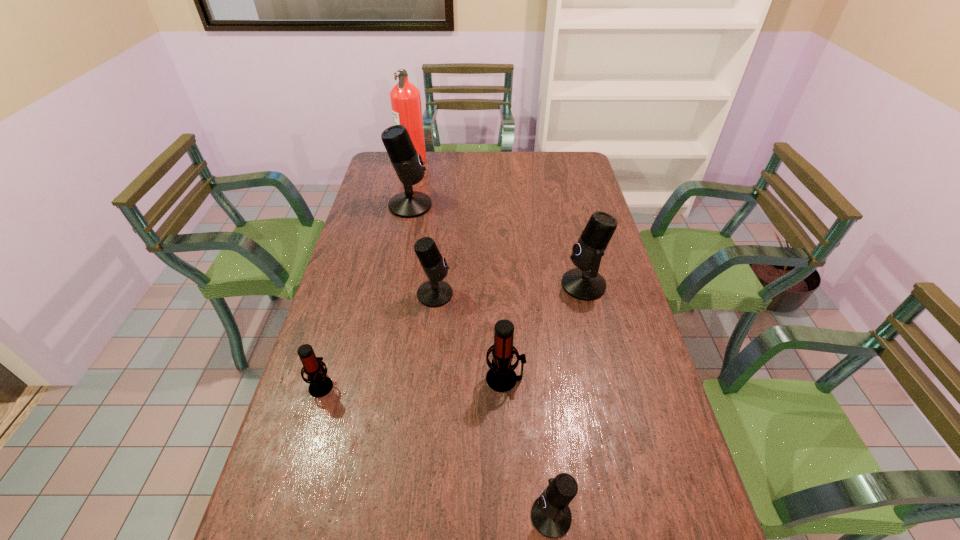
Identify the location of blank space located 0.200m on the stand of the smallest black microphone. Image resolution: width=960 pixels, height=540 pixels. (436, 516).

Image resolution: width=960 pixels, height=540 pixels. What are the coordinates of `vacant region located on the stand of the smallest black microphone` in the screenshot? It's located at (412, 516).

Find the location of `blank area located on the stand of the smallest black microphone`. blank area located on the stand of the smallest black microphone is located at coordinates (445, 516).

Locate an element on the screen. This screenshot has height=540, width=960. object at the far edge is located at coordinates (405, 98).

Image resolution: width=960 pixels, height=540 pixels. Identify the location of fire extinguisher that is at the left edge. (405, 98).

Identify the location of object located in the right edge section of the desktop. (584, 283).

Where is `object at the far left corner`? object at the far left corner is located at coordinates (405, 98).

Locate an element on the screen. The image size is (960, 540). vacant space at the far edge of the desktop is located at coordinates (460, 178).

The height and width of the screenshot is (540, 960). I want to click on vacant region at the left edge of the desktop, so click(x=394, y=238).

Locate an element on the screen. This screenshot has width=960, height=540. vacant space at the right edge of the desktop is located at coordinates (599, 345).